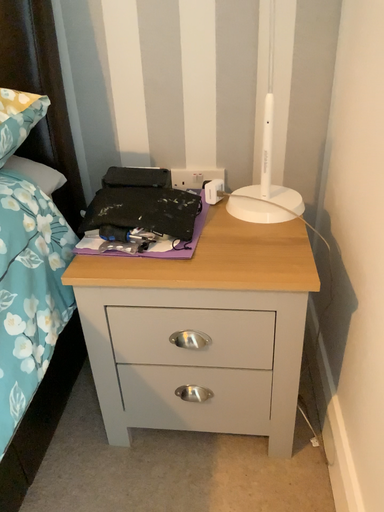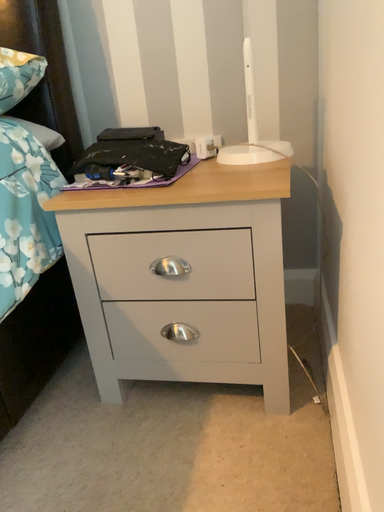
Question: How did the camera likely rotate when shooting the video?

Choices:
 (A) rotated right
 (B) rotated left

Answer: (B)